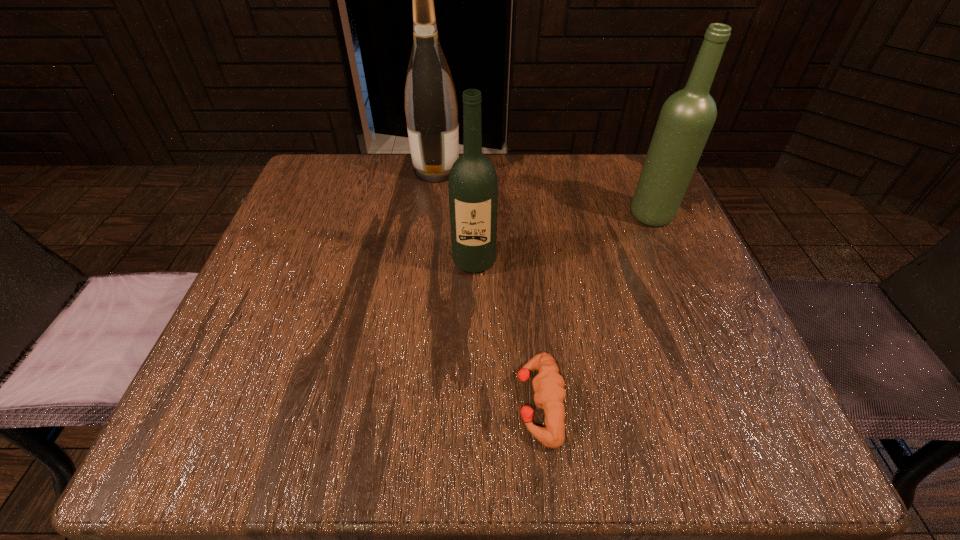
The width and height of the screenshot is (960, 540). In the image, there is a desktop. In order to click on free space at the far right corner in this screenshot , I will do `click(634, 182)`.

Where is `blank region between the nearest object and the nearest wine bottle`? blank region between the nearest object and the nearest wine bottle is located at coordinates (507, 332).

You are a GUI agent. You are given a task and a screenshot of the screen. Output one action in this format:
    pyautogui.click(x=<x>, y=<y>)
    Task: Click on the vacant region between the farthest wine bottle and the rightmost wine bottle
    This screenshot has height=540, width=960.
    Given the screenshot: What is the action you would take?
    pyautogui.click(x=544, y=193)

Locate an element on the screen. The height and width of the screenshot is (540, 960). vacant space that is in between the nearest object and the farthest wine bottle is located at coordinates (488, 287).

The image size is (960, 540). I want to click on empty space between the third object from left to right and the rightmost wine bottle, so click(x=596, y=309).

Image resolution: width=960 pixels, height=540 pixels. Find the location of `free space between the farthest wine bottle and the third object from left to right`. free space between the farthest wine bottle and the third object from left to right is located at coordinates (488, 287).

Where is `free point between the second nearest object and the second farthest wine bottle`? Image resolution: width=960 pixels, height=540 pixels. free point between the second nearest object and the second farthest wine bottle is located at coordinates (564, 238).

Where is `empty location between the shortest object and the farthest object`? The width and height of the screenshot is (960, 540). empty location between the shortest object and the farthest object is located at coordinates (488, 287).

What are the coordinates of `free space between the puncher and the farthest object` in the screenshot? It's located at (488, 287).

I want to click on vacant region between the farthest wine bottle and the second nearest wine bottle, so click(544, 193).